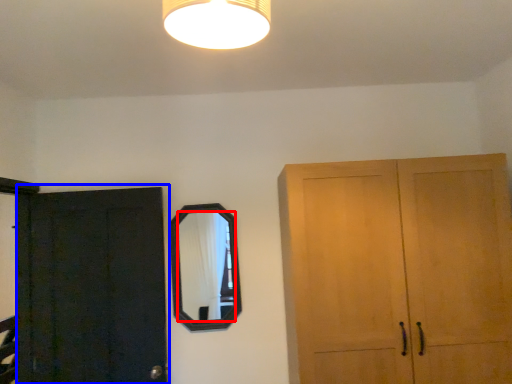
Question: Which object appears farthest to the camera in this image, mirror (highlighted by a red box) or door (highlighted by a blue box)?

Choices:
 (A) mirror
 (B) door

Answer: (A)